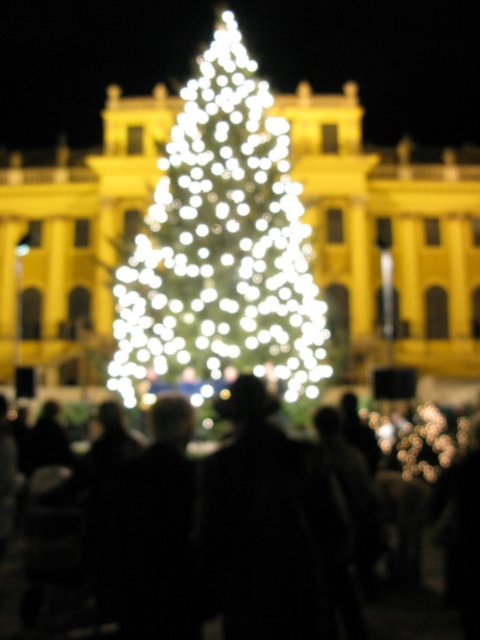
Question: Is yellow matte building at center above illuminated glass christmas tree at center?

Choices:
 (A) yes
 (B) no

Answer: (B)

Question: Considering the real-world distances, which object is farthest from the yellow matte building at center?

Choices:
 (A) illuminated glass christmas tree at center
 (B) black matte crowd at lower center

Answer: (B)

Question: Can you confirm if yellow matte building at center is thinner than illuminated glass christmas tree at center?

Choices:
 (A) yes
 (B) no

Answer: (B)

Question: Can you confirm if yellow matte building at center is positioned to the right of black matte crowd at lower center?

Choices:
 (A) no
 (B) yes

Answer: (B)

Question: Based on their relative distances, which object is nearer to the black matte crowd at lower center?

Choices:
 (A) yellow matte building at center
 (B) illuminated glass christmas tree at center

Answer: (B)

Question: Estimate the real-world distances between objects in this image. Which object is farther from the yellow matte building at center?

Choices:
 (A) illuminated glass christmas tree at center
 (B) black matte crowd at lower center

Answer: (B)